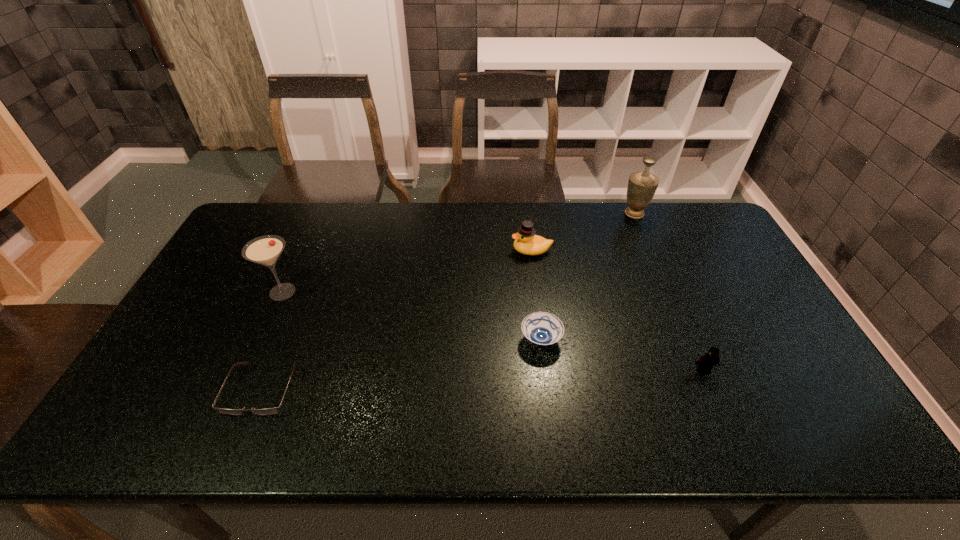
The image size is (960, 540). What are the coordinates of `free spot between the third tallest object and the Lego` in the screenshot? It's located at (617, 310).

The width and height of the screenshot is (960, 540). I want to click on free space between the Lego and the third nearest object, so click(622, 355).

At what (x,y) coordinates should I click in order to perform the action: click on free space between the third farthest object and the Lego. Please return your answer as a coordinate pair (x, y). Looking at the image, I should click on pos(492,331).

This screenshot has height=540, width=960. In order to click on free point between the martini and the spectacles in this screenshot , I will do `click(273, 340)`.

Where is `free space between the fourth nearest object and the soup bowl`? This screenshot has height=540, width=960. free space between the fourth nearest object and the soup bowl is located at coordinates (412, 316).

Locate an element on the screen. vacant space that is in between the fifth nearest object and the third nearest object is located at coordinates (537, 295).

Locate which object is the fifth closest to the urn. Please provide its 2D coordinates. Your answer should be formatted as a tuple, i.e. [(x, y)], where the tuple contains the x and y coordinates of a point satisfying the conditions above.

[(268, 411)]

The image size is (960, 540). Find the location of `object that ranks as the second closest to the Lego`. object that ranks as the second closest to the Lego is located at coordinates (527, 243).

Locate an element on the screen. This screenshot has height=540, width=960. vacant region that satisfies the following two spatial constraints: 1. on the front-facing side of the duck; 2. on the front-facing side of the shortest object is located at coordinates (549, 389).